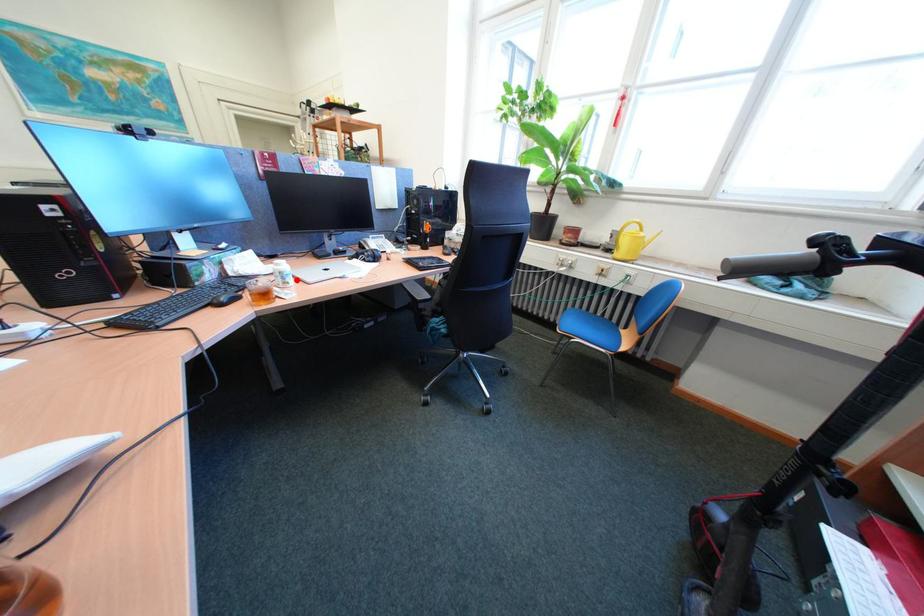
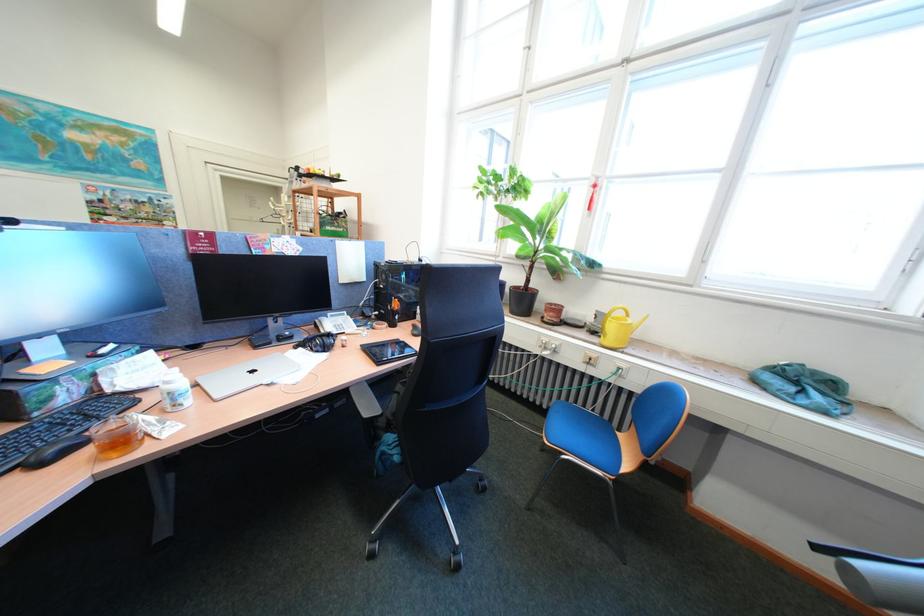
Find the pixel in the second image that matches the highlighted location in the first image.

(187, 402)